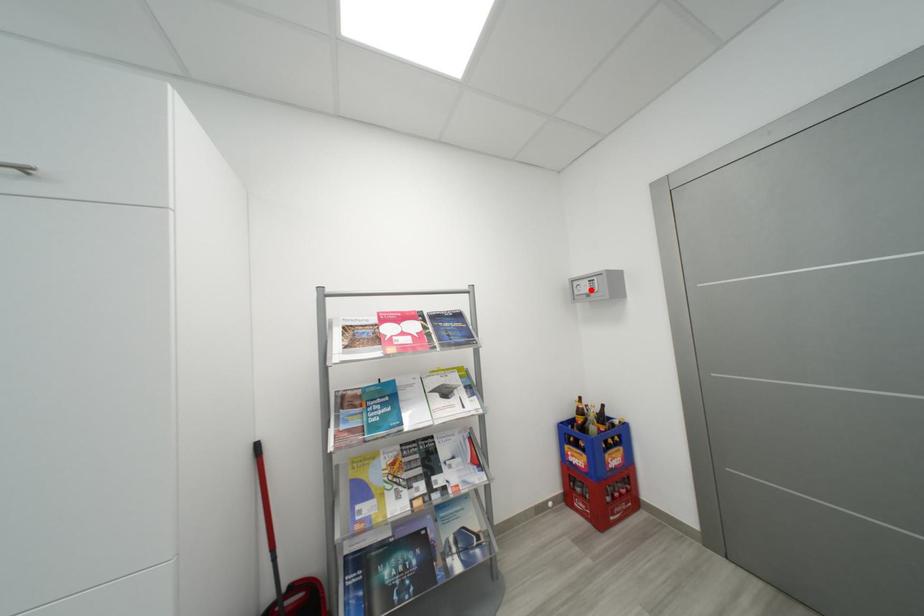
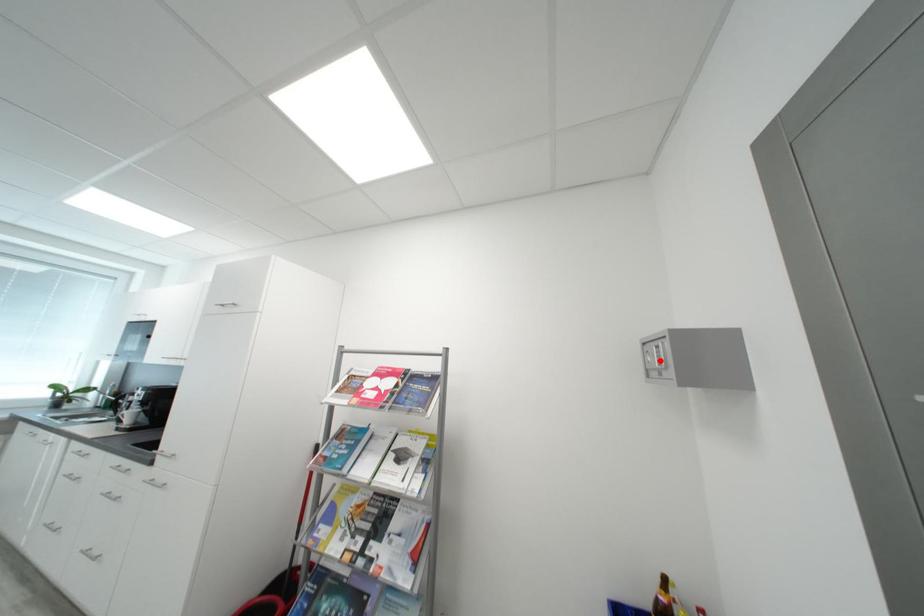
I am providing you with two images of the same scene from different viewpoints. A red point is marked on the first image and another point is marked on the second image. Do the highlighted points in image1 and image2 indicate the same real-world spot?

Yes